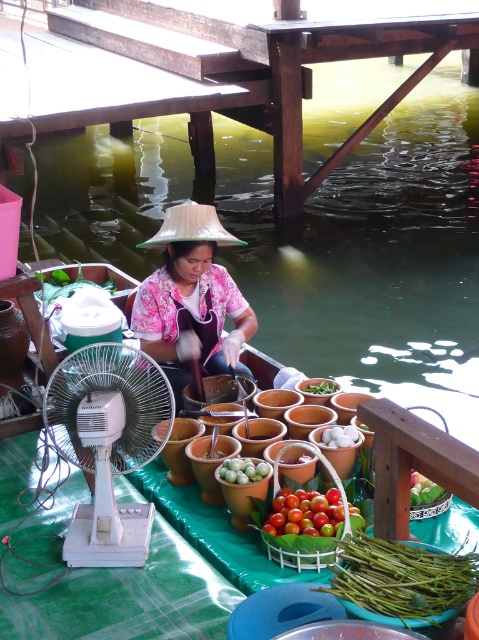
Question: Which point appears closest to the camera in this image?

Choices:
 (A) (53, 104)
 (B) (430, 483)
 (C) (101, 428)
 (D) (305, 381)

Answer: (C)

Question: Based on their relative distances, which object is nearer to the green matte vegetable at center?

Choices:
 (A) pink floral shirt at center
 (B) green matte fruit at center

Answer: (A)

Question: Can you confirm if ripe glossy tomatoes at center is positioned below green matte vegetable at center?

Choices:
 (A) yes
 (B) no

Answer: (A)

Question: Is green matte string beans at lower center wider than green matte fruit at center?

Choices:
 (A) no
 (B) yes

Answer: (B)

Question: Considering the real-world distances, which object is closest to the ripe glossy tomatoes at center?

Choices:
 (A) green matte string beans at lower center
 (B) white plastic mechanical fan at left
 (C) green matte fruit at center

Answer: (C)

Question: Can you confirm if wooden dock at center is positioned below green matte eggplant at center?

Choices:
 (A) no
 (B) yes

Answer: (A)